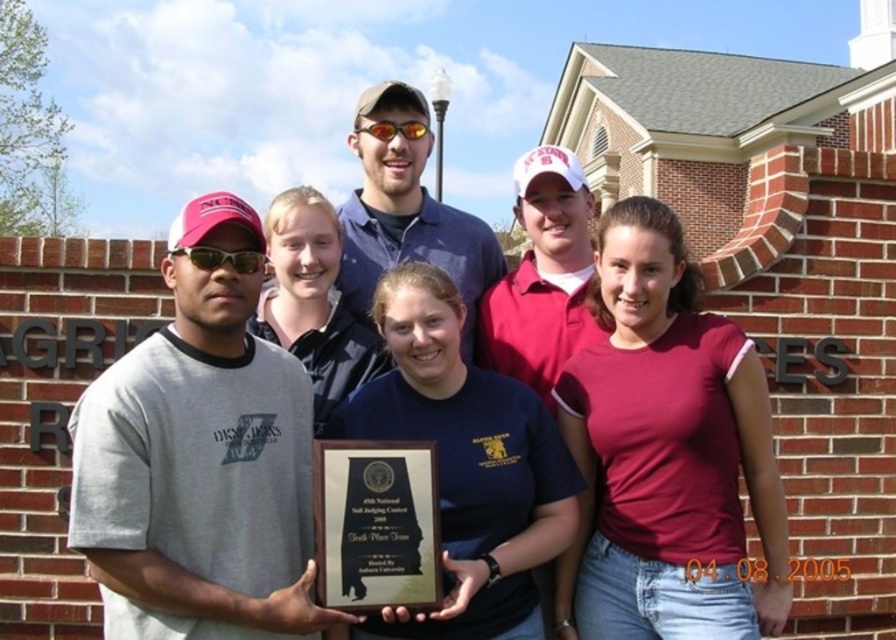
Question: Which point is farther from the camera taking this photo?

Choices:
 (A) (575, 212)
 (B) (205, 451)

Answer: (A)

Question: Estimate the real-world distances between objects in this image. Which object is closer to the matte blue shirt at center?

Choices:
 (A) shiny orange plastic goggles at center
 (B) blue denim shirt at center
 (C) gray cotton t-shirt at left
 (D) sunglasses at left

Answer: (B)

Question: Can you confirm if matte blue shirt at center is positioned to the left of sunglasses at left?

Choices:
 (A) no
 (B) yes

Answer: (A)

Question: Does sunglasses at left appear on the left side of shiny orange plastic goggles at center?

Choices:
 (A) no
 (B) yes

Answer: (B)

Question: Which point is farther to the camera?

Choices:
 (A) sunglasses at left
 (B) blue denim shirt at center
 (C) shiny orange plastic goggles at center
 (D) matte blue shirt at center

Answer: (C)

Question: Is the position of blue denim shirt at center less distant than that of sunglasses at left?

Choices:
 (A) no
 (B) yes

Answer: (A)